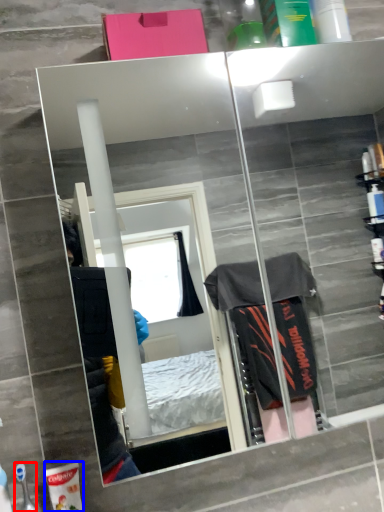
Question: Which point is further to the camera, toiletry (highlighted by a red box) or toiletry (highlighted by a blue box)?

Choices:
 (A) toiletry
 (B) toiletry

Answer: (B)